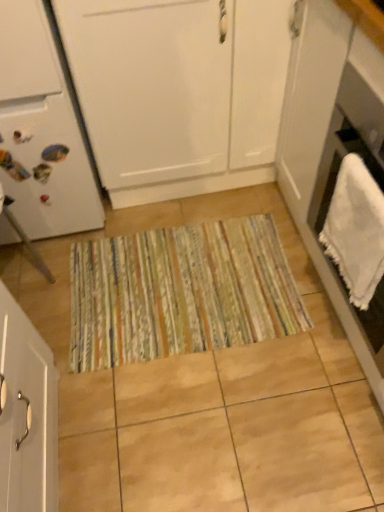
Question: From a real-world perspective, does white matte refrigerator at left sit lower than white matte cabinet at center, the second cabinetry positioned from the bottom?

Choices:
 (A) no
 (B) yes

Answer: (A)

Question: Could you tell me if white matte refrigerator at left is turned towards white matte cabinet at center, the second cabinetry positioned from the bottom?

Choices:
 (A) no
 (B) yes

Answer: (A)

Question: Can white matte cabinet at center, the second cabinetry positioned from the bottom, be found inside white matte refrigerator at left?

Choices:
 (A) no
 (B) yes

Answer: (A)

Question: Is white matte refrigerator at left to the right of white matte cabinet at center, the second cabinetry positioned from the bottom, from the viewer's perspective?

Choices:
 (A) yes
 (B) no

Answer: (B)

Question: Are white matte refrigerator at left and white matte cabinet at center, the first cabinetry from the top, located far from each other?

Choices:
 (A) no
 (B) yes

Answer: (A)

Question: In terms of size, does white towel at right appear bigger or smaller than white matte refrigerator at left?

Choices:
 (A) big
 (B) small

Answer: (B)

Question: In the image, is white towel at right positioned in front of or behind white matte refrigerator at left?

Choices:
 (A) behind
 (B) front

Answer: (B)

Question: Looking at their shapes, would you say white towel at right is wider or thinner than white matte refrigerator at left?

Choices:
 (A) thin
 (B) wide

Answer: (A)

Question: Is white towel at right to the left or to the right of white matte refrigerator at left in the image?

Choices:
 (A) right
 (B) left

Answer: (A)

Question: From the image's perspective, is white matte cabinet at center, the first cabinetry from the top, above or below white towel at right?

Choices:
 (A) below
 (B) above

Answer: (B)

Question: Considering their positions, is white matte cabinet at center, the first cabinetry from the top, located in front of or behind white towel at right?

Choices:
 (A) front
 (B) behind

Answer: (B)

Question: Considering the positions of white matte cabinet at center, the second cabinetry positioned from the bottom, and white towel at right in the image, is white matte cabinet at center, the second cabinetry positioned from the bottom, taller or shorter than white towel at right?

Choices:
 (A) short
 (B) tall

Answer: (B)

Question: Based on their positions, is white matte cabinet at center, the first cabinetry from the top, located to the left or right of white towel at right?

Choices:
 (A) left
 (B) right

Answer: (A)

Question: From their relative heights in the image, would you say white matte cabinet at lower left, the first cabinetry from the bottom, is taller or shorter than striped fabric doormat at center?

Choices:
 (A) short
 (B) tall

Answer: (B)

Question: Relative to striped fabric doormat at center, is white matte cabinet at lower left, the second cabinetry when ordered from top to bottom, in front or behind?

Choices:
 (A) front
 (B) behind

Answer: (A)